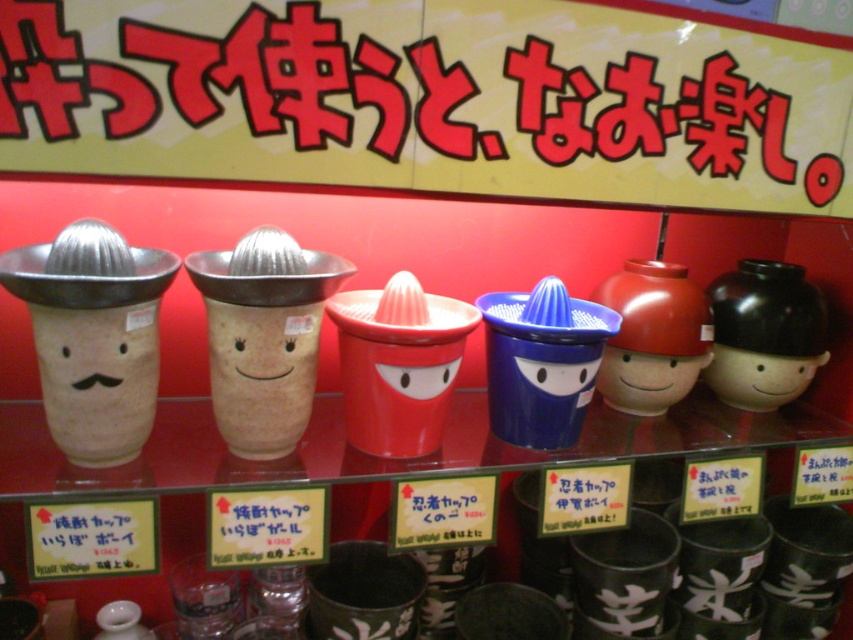
Who is positioned more to the left, matte ceramic face at left or matte ceramic cup at center?

matte ceramic face at left

Is matte ceramic face at left to the right of matte ceramic cup at center from the viewer's perspective?

In fact, matte ceramic face at left is to the left of matte ceramic cup at center.

Is point (84, 349) positioned before point (662, 387)?

Yes, point (84, 349) is in front of point (662, 387).

This screenshot has width=853, height=640. Identify the location of matte ceramic face at left. (97, 378).

Which is more to the left, matte ceramic bowl at right or matte ceramic cup at center?

From the viewer's perspective, matte ceramic cup at center appears more on the left side.

Based on the photo, is matte ceramic bowl at right taller than matte ceramic cup at center?

Yes.

Is point (718, 394) positioned in front of point (670, 355)?

That is False.

Where is `matte ceramic bowl at right`? matte ceramic bowl at right is located at coordinates (758, 378).

Between point (459, 12) and point (628, 387), which one is positioned in front?

Point (459, 12) is more forward.

Does brushed metal sign at upper center have a greater height compared to matte ceramic cup at center?

Indeed, brushed metal sign at upper center has a greater height compared to matte ceramic cup at center.

You are a GUI agent. You are given a task and a screenshot of the screen. Output one action in this format:
    pyautogui.click(x=<x>, y=<y>)
    Task: Click on the brushed metal sign at upper center
    
    Given the screenshot: What is the action you would take?
    pyautogui.click(x=428, y=99)

This screenshot has height=640, width=853. Identify the location of brushed metal sign at upper center. [x=428, y=99].